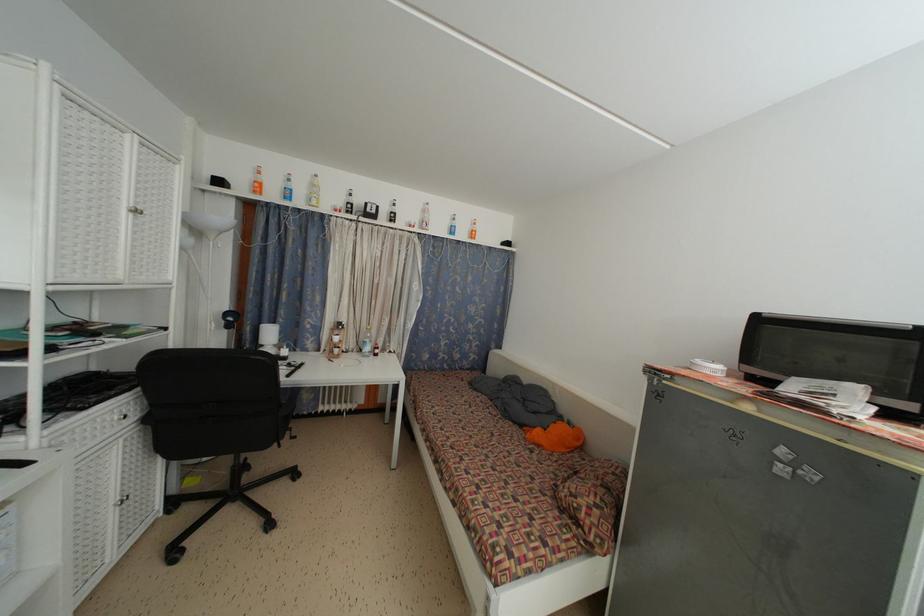
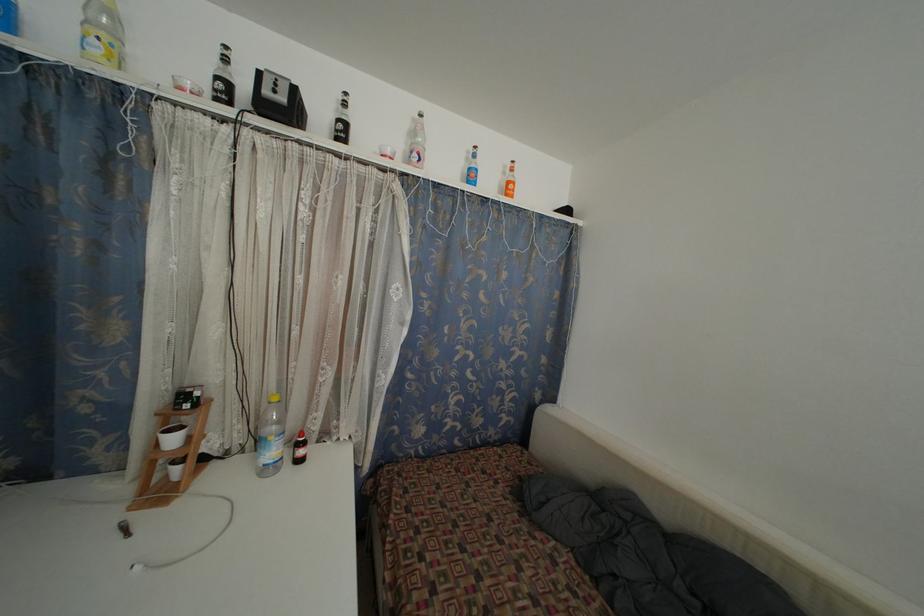
Locate, in the second image, the point that corresponds to pixel 396 220 in the first image.

(345, 132)